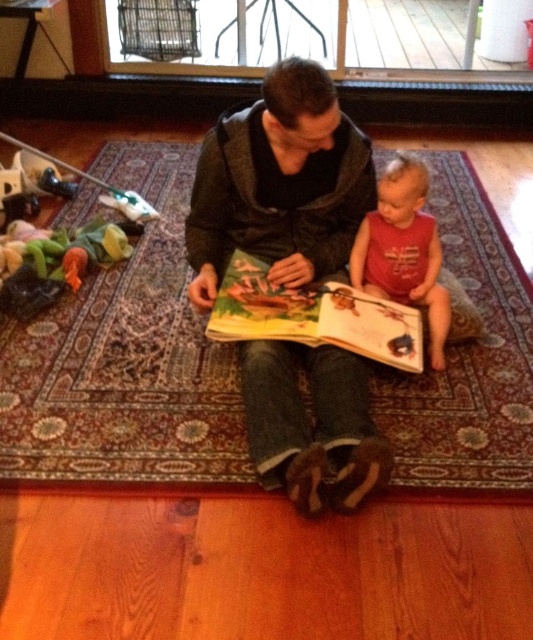
Question: Can you confirm if hardcover book at center is positioned to the right of multicolored plush toy at left?

Choices:
 (A) no
 (B) yes

Answer: (B)

Question: Estimate the real-world distances between objects in this image. Which object is farther from the red cotton shirt at center?

Choices:
 (A) hardcover book at center
 (B) multicolored plush toy at left
 (C) dark gray hoodie at center

Answer: (B)

Question: Is hardcover book at center above red cotton shirt at center?

Choices:
 (A) yes
 (B) no

Answer: (B)

Question: Which of the following is the farthest from the observer?

Choices:
 (A) (447, 323)
 (B) (20, 244)
 (C) (362, 340)

Answer: (B)

Question: Is the position of hardcover book at center less distant than that of red cotton shirt at center?

Choices:
 (A) yes
 (B) no

Answer: (A)

Question: Which object is positioned closest to the hardcover book at center?

Choices:
 (A) dark gray hoodie at center
 (B) red cotton shirt at center
 (C) multicolored plush toy at left

Answer: (A)